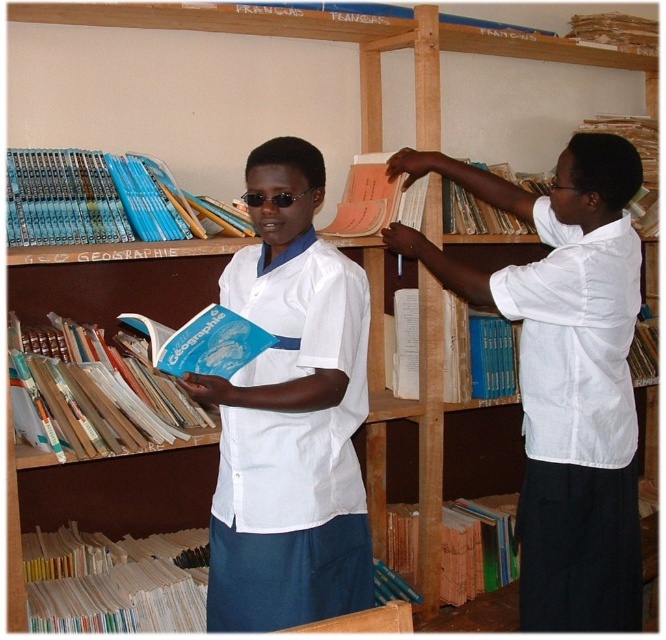
You are a student in the library who needs to reach the brown cardboard book at upper right and the blue paper book at lower center. Which book do you need to move first to access the other?

The brown cardboard book at upper right is above the blue paper book at lower center, so you need to move the brown cardboard book at upper right first to access the blue paper book at lower center.

You are standing in the library and want to reach a book located at point [647,369]. There is another object at point [330,483]. Which point is closer to you?

Point [330,483] is closer to the viewer than point [647,369], so the closer point to you is point [330,483].

You are standing in the library and see two points marked in the image. Which point, point [99,214] or point [446,188], is closer to you?

Point [99,214] is closer to the viewer than point [446,188].